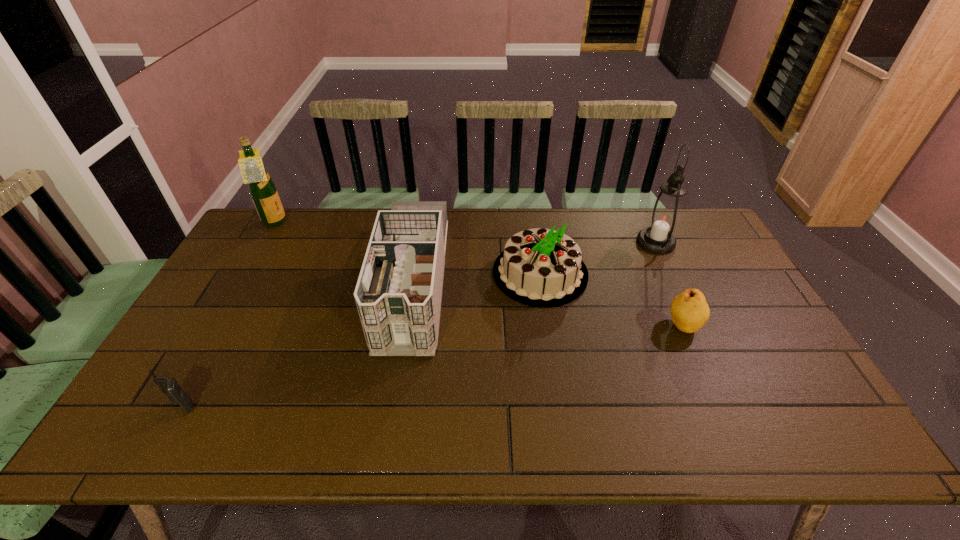
At what (x,y) coordinates should I click in order to perform the action: click on oil lamp. Please return your answer as a coordinate pair (x, y). The image size is (960, 540). Looking at the image, I should click on (664, 217).

At what (x,y) coordinates should I click in order to perform the action: click on liquor. Please return your answer as a coordinate pair (x, y). Image resolution: width=960 pixels, height=540 pixels. Looking at the image, I should click on (262, 189).

Identify the location of the third object from left to right. (398, 294).

The height and width of the screenshot is (540, 960). In order to click on birthday cake in this screenshot , I will do `click(539, 267)`.

Where is `pear`? The image size is (960, 540). pear is located at coordinates (689, 310).

The image size is (960, 540). In order to click on cellular telephone in this screenshot , I will do `click(169, 386)`.

The image size is (960, 540). I want to click on vacant space situated on the left of the oil lamp, so click(x=542, y=242).

The height and width of the screenshot is (540, 960). In order to click on vacant space located 0.320m on the front-facing side of the liquor in this screenshot , I will do pyautogui.click(x=377, y=223).

Locate an element on the screen. The width and height of the screenshot is (960, 540). blank space located at the entrance of the dollhouse is located at coordinates (394, 401).

In order to click on free region located 0.090m on the front of the fourth object from left to right in this screenshot , I will do `click(549, 332)`.